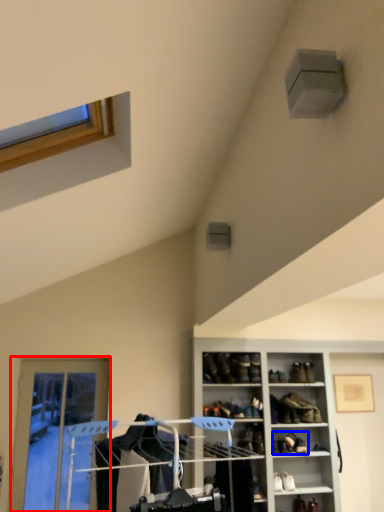
Question: Which object appears farthest to the camera in this image, door (highlighted by a red box) or footwear (highlighted by a blue box)?

Choices:
 (A) door
 (B) footwear

Answer: (A)